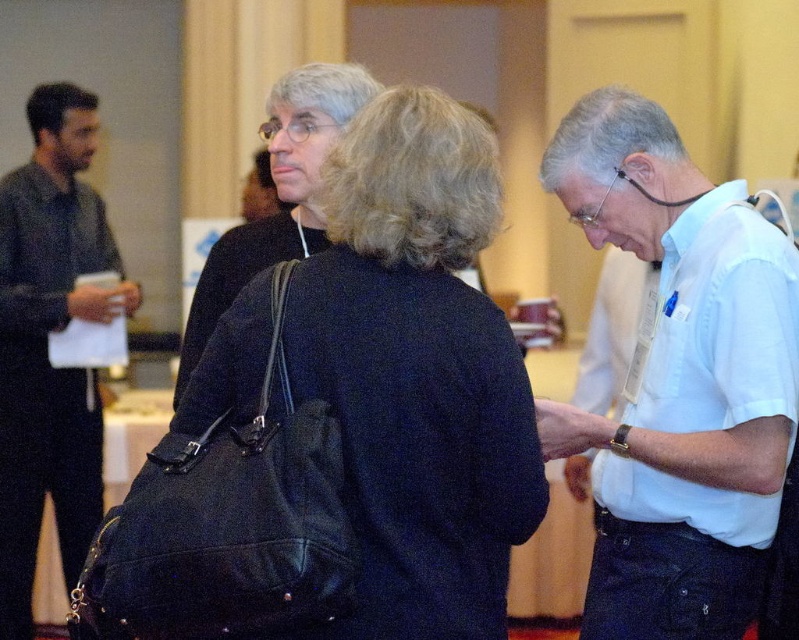
Image resolution: width=799 pixels, height=640 pixels. I want to click on black leather bag at center, so click(418, 372).

Between black leather bag at center and white cotton shirt at center, which one is positioned lower?

white cotton shirt at center is below.

Which is behind, point (478, 408) or point (782, 339)?

The point (782, 339) is behind.

Find the location of a particular element. The height and width of the screenshot is (640, 799). black leather bag at center is located at coordinates (418, 372).

Is black leather bag at center wider than dark gray shirt at left?

Yes, black leather bag at center is wider than dark gray shirt at left.

Which is above, black leather bag at center or dark gray shirt at left?

black leather bag at center is higher up.

Image resolution: width=799 pixels, height=640 pixels. What do you see at coordinates (418, 372) in the screenshot? I see `black leather bag at center` at bounding box center [418, 372].

You are a GUI agent. You are given a task and a screenshot of the screen. Output one action in this format:
    pyautogui.click(x=<x>, y=<y>)
    Task: Click on the black leather bag at center
    Image resolution: width=799 pixels, height=640 pixels.
    Given the screenshot: What is the action you would take?
    pyautogui.click(x=418, y=372)

Between point (776, 394) and point (8, 576), which one is positioned in front?

Point (776, 394) is more forward.

Looking at this image, is white cotton shirt at center shorter than dark gray shirt at left?

Indeed, white cotton shirt at center has a lesser height compared to dark gray shirt at left.

The image size is (799, 640). In order to click on white cotton shirt at center in this screenshot , I will do `click(678, 380)`.